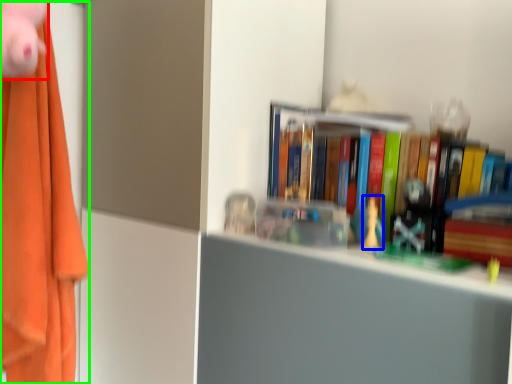
Question: Which object is the closest to the toy (highlighted by a red box)? Choose among these: toy (highlighted by a blue box) or clothe (highlighted by a green box).

Choices:
 (A) toy
 (B) clothe

Answer: (A)